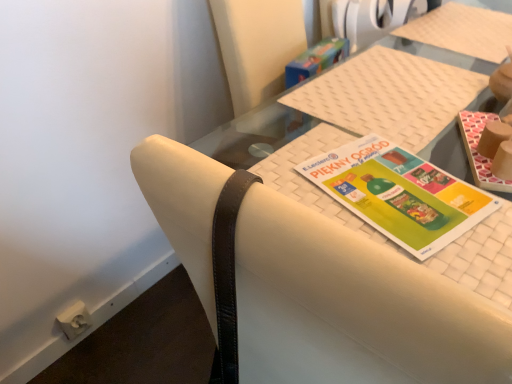
The height and width of the screenshot is (384, 512). What are the coordinates of `vacant space behind multicolored paper at center, positioned as the 2th book in right-to-left order` in the screenshot? It's located at (368, 120).